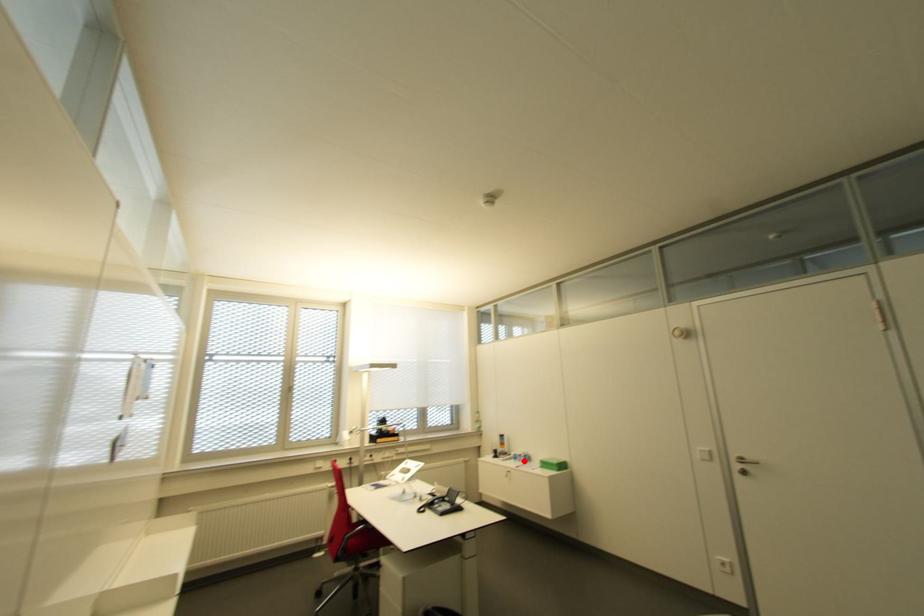
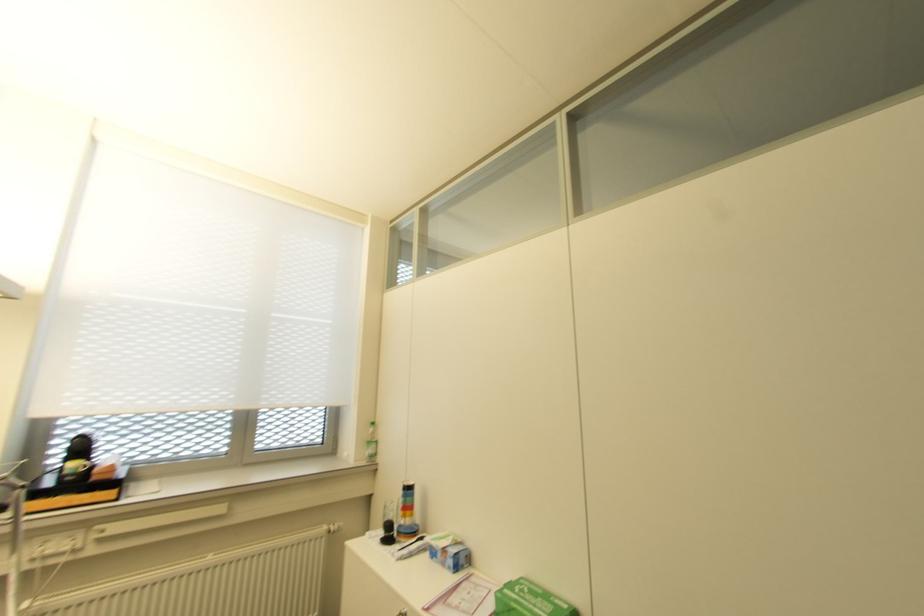
Question: I am providing you with two images of the same scene from different viewpoints. In image1, a red point is highlighted. Considering the same 3D point in image2, which of the following is correct?

Choices:
 (A) It is closer
 (B) It is farther

Answer: (A)